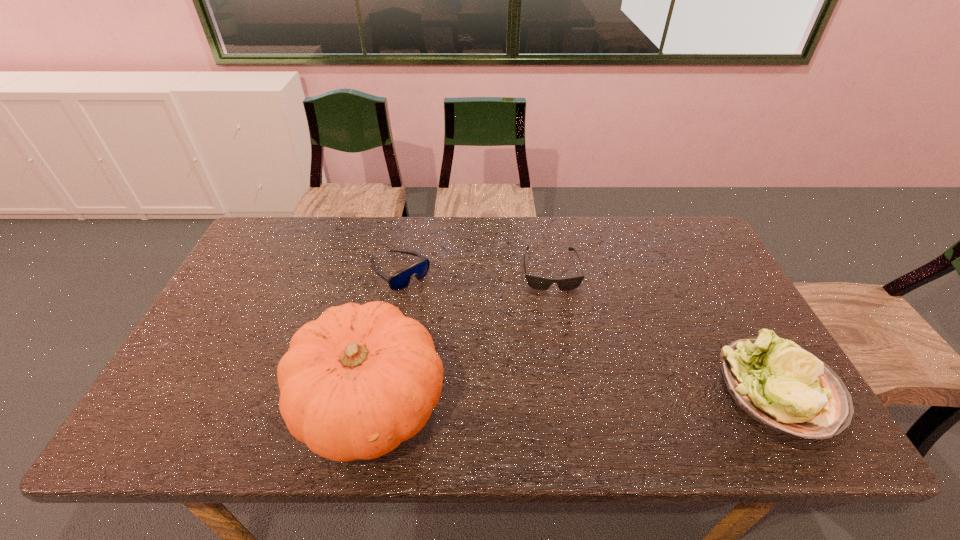
The height and width of the screenshot is (540, 960). What are the coordinates of `vacant space situated on the front-facing side of the right sunglasses` in the screenshot? It's located at [563, 370].

Locate an element on the screen. free space located on the front-facing side of the right sunglasses is located at coordinates (563, 374).

Where is `free space located 0.270m on the front-facing side of the third tallest object`? This screenshot has height=540, width=960. free space located 0.270m on the front-facing side of the third tallest object is located at coordinates (477, 343).

Locate an element on the screen. free space located on the front-facing side of the third tallest object is located at coordinates 470,336.

Where is `free region located on the front-facing side of the third tallest object`? free region located on the front-facing side of the third tallest object is located at coordinates (458, 326).

This screenshot has height=540, width=960. What are the coordinates of `pumpkin at the near edge` in the screenshot? It's located at (355, 383).

Identify the location of lettuce that is positioned at the near edge. (784, 387).

Find the location of a particular element. The image size is (960, 540). object at the right edge is located at coordinates (784, 387).

Where is `object located at the near right corner`? object located at the near right corner is located at coordinates (784, 387).

At what (x,y) coordinates should I click in order to perform the action: click on free location at the far edge of the desktop. Please return your answer as a coordinate pair (x, y). Looking at the image, I should click on (563, 251).